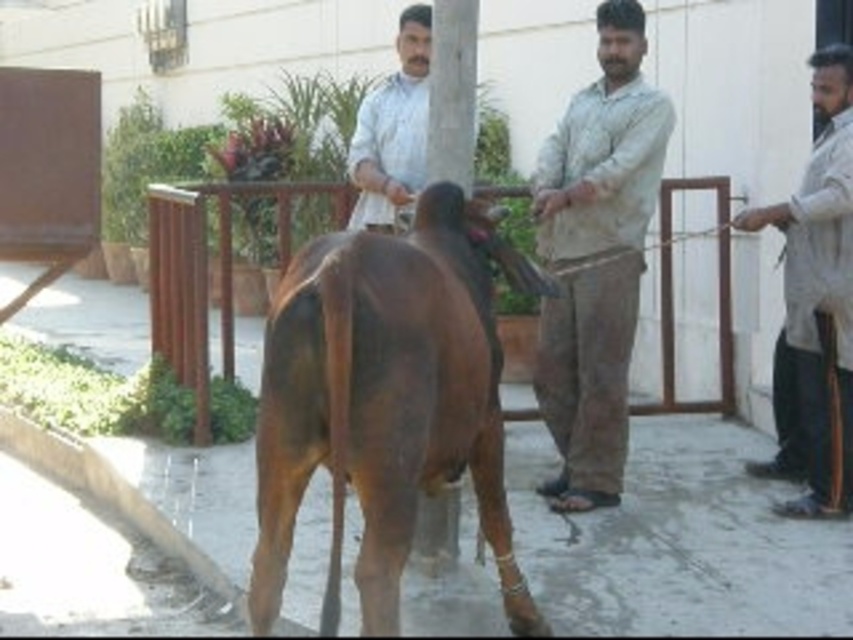
Is light beige shirt at right to the right of white matte shirt at center from the viewer's perspective?

Indeed, light beige shirt at right is positioned on the right side of white matte shirt at center.

Does light beige shirt at right appear on the left side of white matte shirt at center?

In fact, light beige shirt at right is to the right of white matte shirt at center.

Who is more forward, (776, 211) or (407, 32)?

Point (776, 211) is in front.

Where is `light beige shirt at right`? The image size is (853, 640). light beige shirt at right is located at coordinates (820, 289).

Is point (589, 477) positioned behind point (846, 282)?

Yes, it is behind point (846, 282).

Who is more distant from viewer, [660,145] or [827,172]?

Positioned behind is point [660,145].

This screenshot has height=640, width=853. What are the coordinates of `light beige cotton shirt at center` in the screenshot? It's located at pos(596,257).

The width and height of the screenshot is (853, 640). Describe the element at coordinates (386, 401) in the screenshot. I see `brown glossy bull at center` at that location.

Can you confirm if brown glossy bull at center is positioned to the left of light beige shirt at right?

Yes, brown glossy bull at center is to the left of light beige shirt at right.

Does point (264, 611) lie behind point (849, 209)?

No.

Image resolution: width=853 pixels, height=640 pixels. Identify the location of brown glossy bull at center. (386, 401).